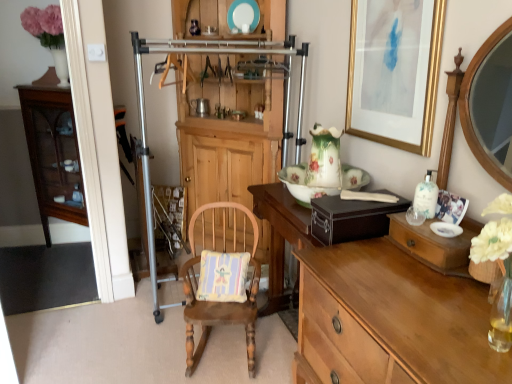
Locate an element on the screen. Image resolution: width=512 pixels, height=384 pixels. vacant space in mahogany glass-front cabinet at left, which ranks as the first cabinetry in left-to-right order (from a real-world perspective) is located at coordinates (65, 255).